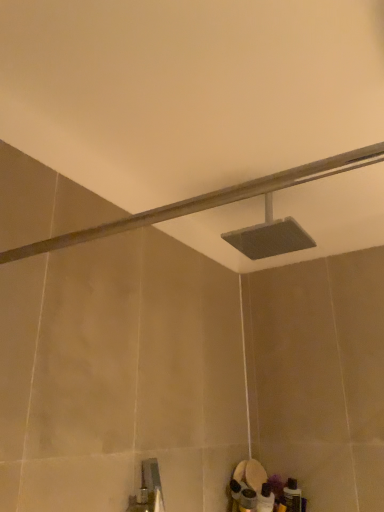
Question: Considering the positions of matte gray showerhead at upper center, which is the second shower from back to front, and matte gray showerhead at center, the 2th shower when ordered from front to back, in the image, is matte gray showerhead at upper center, which is the second shower from back to front, taller or shorter than matte gray showerhead at center, the 2th shower when ordered from front to back,?

Choices:
 (A) tall
 (B) short

Answer: (B)

Question: From the image's perspective, is matte gray showerhead at upper center, which is the second shower from back to front, positioned above or below matte gray showerhead at center, which is the first shower from back to front?

Choices:
 (A) below
 (B) above

Answer: (A)

Question: In the image, is matte gray showerhead at upper center, which is the second shower from back to front, positioned in front of or behind matte gray showerhead at center, which is the first shower from back to front?

Choices:
 (A) behind
 (B) front

Answer: (B)

Question: Considering the positions of matte gray showerhead at center, the 2th shower when ordered from front to back, and matte gray showerhead at upper center, the 1th shower viewed from the front, in the image, is matte gray showerhead at center, the 2th shower when ordered from front to back, bigger or smaller than matte gray showerhead at upper center, the 1th shower viewed from the front,?

Choices:
 (A) small
 (B) big

Answer: (B)

Question: Is matte gray showerhead at center, which is the first shower from back to front, taller or shorter than matte gray showerhead at upper center, which is the second shower from back to front?

Choices:
 (A) short
 (B) tall

Answer: (B)

Question: Is matte gray showerhead at center, which is the first shower from back to front, wider or thinner than matte gray showerhead at upper center, the 1th shower viewed from the front?

Choices:
 (A) thin
 (B) wide

Answer: (A)

Question: From a real-world perspective, relative to matte gray showerhead at upper center, the 1th shower viewed from the front, is matte gray showerhead at center, the 2th shower when ordered from front to back, vertically above or below?

Choices:
 (A) above
 (B) below

Answer: (A)